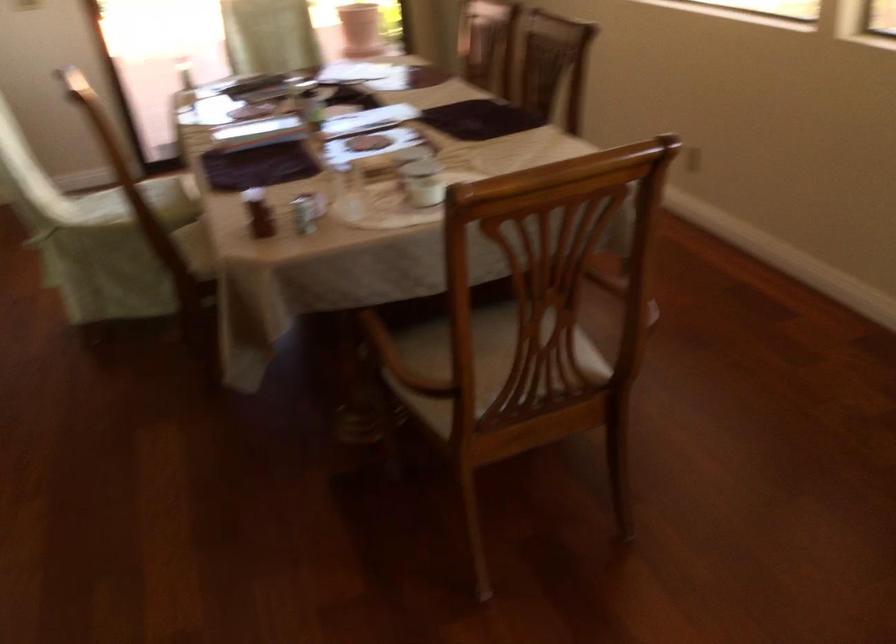
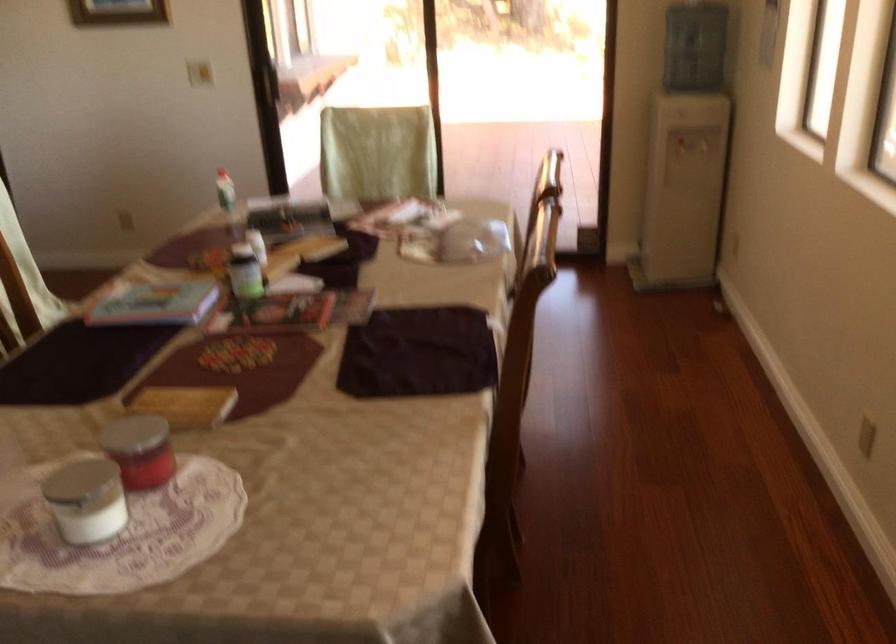
Where in the second image is the point corresponding to pixel 306 100 from the first image?

(245, 272)